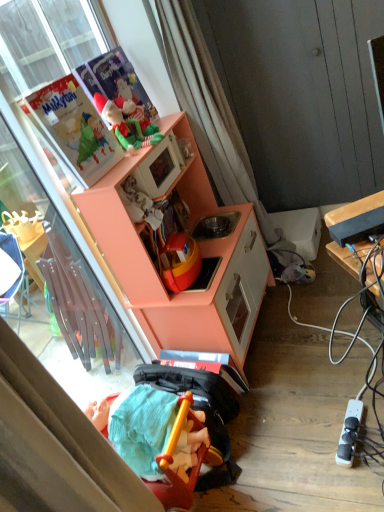
What do you see at coordinates (201, 254) in the screenshot? This screenshot has height=512, width=384. I see `peach matte cabinet at upper left` at bounding box center [201, 254].

You are a GUI agent. You are given a task and a screenshot of the screen. Output one action in this format:
    pyautogui.click(x=<x>, y=<y>)
    Task: Click on the rubberized plastic toy at lower center, the 2th toy from the back
    
    Given the screenshot: What is the action you would take?
    pyautogui.click(x=155, y=440)

What is the approximate height of transparent glass door at upper left?

The height of transparent glass door at upper left is 5.01 feet.

Measure the distance between white plastic power outlet at lower right and camera.

white plastic power outlet at lower right is 4.52 feet from camera.

This screenshot has height=512, width=384. What do you see at coordinates (209, 110) in the screenshot? I see `white sheer curtain at upper center` at bounding box center [209, 110].

You are a GUI agent. You are given a task and a screenshot of the screen. Output one action in this format:
    pyautogui.click(x=<x>, y=<y>)
    Task: Click on the peach matte cabinet at upper left
    The height and width of the screenshot is (512, 384).
    Given the screenshot: What is the action you would take?
    pyautogui.click(x=201, y=254)

From the image's perspective, is black plastic tv at right on top of white plastic power outlet at lower right?

Indeed, from the image's perspective, black plastic tv at right is shown above white plastic power outlet at lower right.

Image resolution: width=384 pixels, height=512 pixels. Identify the location of appliance in front of the white plastic power outlet at lower right. (357, 220).

Consider the image. Is white plastic power outlet at lower right completely or partially inside black plastic tv at right?

No, white plastic power outlet at lower right is located outside of black plastic tv at right.

Is point (373, 226) more distant than point (361, 408)?

That is False.

Which object is wider, transparent glass door at upper left or green felt elf at upper center, arranged as the first toy when viewed from the top?

green felt elf at upper center, arranged as the first toy when viewed from the top.

I want to click on toy that is above the transparent glass door at upper left (from a real-world perspective), so point(127,123).

From the image's perspective, is transparent glass door at upper left positioned above or below green felt elf at upper center, the 2th toy when ordered from front to back?

From the image's perspective, transparent glass door at upper left appears below green felt elf at upper center, the 2th toy when ordered from front to back.

Is there a large distance between transparent glass door at upper left and green felt elf at upper center, arranged as the 1th toy when viewed from the back?

No, transparent glass door at upper left is not far from green felt elf at upper center, arranged as the 1th toy when viewed from the back.

From the image's perspective, is white plastic power outlet at lower right on green felt elf at upper center, the 2th toy when ordered from front to back?

No, from the image's perspective, white plastic power outlet at lower right is not above green felt elf at upper center, the 2th toy when ordered from front to back.

Is white plastic power outlet at lower right positioned with its back to green felt elf at upper center, which ranks as the second toy in bottom-to-top order?

white plastic power outlet at lower right does not have its back to green felt elf at upper center, which ranks as the second toy in bottom-to-top order.

Considering the sizes of objects white plastic power outlet at lower right and green felt elf at upper center, arranged as the first toy when viewed from the top, in the image provided, who is thinner, white plastic power outlet at lower right or green felt elf at upper center, arranged as the first toy when viewed from the top,?

green felt elf at upper center, arranged as the first toy when viewed from the top, is thinner.

Considering the relative positions of white plastic power outlet at lower right and green felt elf at upper center, arranged as the 1th toy when viewed from the back, in the image provided, is white plastic power outlet at lower right to the left or to the right of green felt elf at upper center, arranged as the 1th toy when viewed from the back,?

In the image, white plastic power outlet at lower right appears on the right side of green felt elf at upper center, arranged as the 1th toy when viewed from the back.

From a real-world perspective, is green felt elf at upper center, which ranks as the second toy in bottom-to-top order, physically below black plastic tv at right?

No, from a real-world perspective, green felt elf at upper center, which ranks as the second toy in bottom-to-top order, is not below black plastic tv at right.

From the image's perspective, is green felt elf at upper center, arranged as the 1th toy when viewed from the back, over black plastic tv at right?

Yes, from the image's perspective, green felt elf at upper center, arranged as the 1th toy when viewed from the back, is over black plastic tv at right.

Consider the image. Is green felt elf at upper center, which ranks as the second toy in bottom-to-top order, beside black plastic tv at right?

green felt elf at upper center, which ranks as the second toy in bottom-to-top order, and black plastic tv at right are not in contact.

Is green felt elf at upper center, arranged as the first toy when viewed from the top, facing towards black plastic tv at right?

No, green felt elf at upper center, arranged as the first toy when viewed from the top, is not facing towards black plastic tv at right.

Considering the points (182, 63) and (360, 417), which point is in front, point (182, 63) or point (360, 417)?

The point (360, 417) is in front.

The image size is (384, 512). I want to click on curtain lying behind the white plastic power outlet at lower right, so click(x=209, y=110).

Is white sheer curtain at upper center inside or outside of white plastic power outlet at lower right?

white sheer curtain at upper center is not inside white plastic power outlet at lower right, it's outside.

Can you see white sheer curtain at upper center touching white plastic power outlet at lower right?

No, white sheer curtain at upper center is not touching white plastic power outlet at lower right.

How different are the orientations of black plastic tv at right and peach matte cabinet at upper left in degrees?

59.6 degrees.

Which of these two, black plastic tv at right or peach matte cabinet at upper left, is smaller?

Smaller between the two is black plastic tv at right.

Between black plastic tv at right and peach matte cabinet at upper left, which one has smaller width?

black plastic tv at right.

Which of these two, black plastic tv at right or peach matte cabinet at upper left, stands taller?

With more height is peach matte cabinet at upper left.

Is point (215, 273) in front of point (354, 209)?

No, it is not.

Can you confirm if peach matte cabinet at upper left is bigger than black plastic tv at right?

Yes, peach matte cabinet at upper left is bigger than black plastic tv at right.

Is peach matte cabinet at upper left not close to black plastic tv at right?

Actually, peach matte cabinet at upper left and black plastic tv at right are a little close together.

Between peach matte cabinet at upper left and black plastic tv at right, which one has more height?

A: peach matte cabinet at upper left is taller.

Locate an element on the screen. appliance lying in front of the white plastic power outlet at lower right is located at coordinates (357, 220).

The image size is (384, 512). There is a transparent glass door at upper left. In order to click on toy above it (from a real-world perspective) in this screenshot , I will do `click(127, 123)`.

Which object lies further to the anchor point rubberized plastic toy at lower center, the 2th toy from the back, transparent glass door at upper left or white plastic power outlet at lower right?

The object further to rubberized plastic toy at lower center, the 2th toy from the back, is white plastic power outlet at lower right.

Which object lies further to the anchor point rubberized plastic toy at lower center, placed as the first toy when sorted from front to back, green felt elf at upper center, which ranks as the second toy in bottom-to-top order, or black plastic tv at right?

green felt elf at upper center, which ranks as the second toy in bottom-to-top order.

From the picture: When comparing their distances from peach matte cabinet at upper left, does rubberized plastic toy at lower center, the 2th toy from the back, or green felt elf at upper center, arranged as the 1th toy when viewed from the back, seem closer?

Among the two, green felt elf at upper center, arranged as the 1th toy when viewed from the back, is located nearer to peach matte cabinet at upper left.

Estimate the real-world distances between objects in this image. Which object is closer to white plastic power outlet at lower right, transparent glass door at upper left or green felt elf at upper center, the 2th toy when ordered from front to back?

transparent glass door at upper left lies closer to white plastic power outlet at lower right than the other object.

When comparing their distances from black plastic tv at right, does rubberized plastic toy at lower center, the 2th toy from the back, or white plastic power outlet at lower right seem closer?

Among the two, white plastic power outlet at lower right is located nearer to black plastic tv at right.

Which object lies further to the anchor point green felt elf at upper center, arranged as the 1th toy when viewed from the back, white sheer curtain at upper center or peach matte cabinet at upper left?

Among the two, white sheer curtain at upper center is located further to green felt elf at upper center, arranged as the 1th toy when viewed from the back.

Looking at the image, which one is located further to white plastic power outlet at lower right, white sheer curtain at upper center or transparent glass door at upper left?

white sheer curtain at upper center.

Which object lies nearer to the anchor point peach matte cabinet at upper left, white sheer curtain at upper center or white plastic power outlet at lower right?

white sheer curtain at upper center lies closer to peach matte cabinet at upper left than the other object.

This screenshot has height=512, width=384. In order to click on power outlet between transparent glass door at upper left and rubberized plastic toy at lower center, which appears as the 1th toy when ordered from the bottom, in the vertical direction in this screenshot , I will do `click(349, 433)`.

This screenshot has width=384, height=512. I want to click on cabinetry between black plastic tv at right and white plastic power outlet at lower right vertically, so click(201, 254).

You are a GUI agent. You are given a task and a screenshot of the screen. Output one action in this format:
    pyautogui.click(x=<x>, y=<y>)
    Task: Click on the curtain between green felt elf at upper center, the 2th toy when ordered from front to back, and peach matte cabinet at upper left, in the vertical direction
    This screenshot has height=512, width=384.
    Given the screenshot: What is the action you would take?
    pyautogui.click(x=209, y=110)

The height and width of the screenshot is (512, 384). I want to click on appliance between green felt elf at upper center, arranged as the first toy when viewed from the top, and rubberized plastic toy at lower center, the 2th toy from the back, in the vertical direction, so click(357, 220).